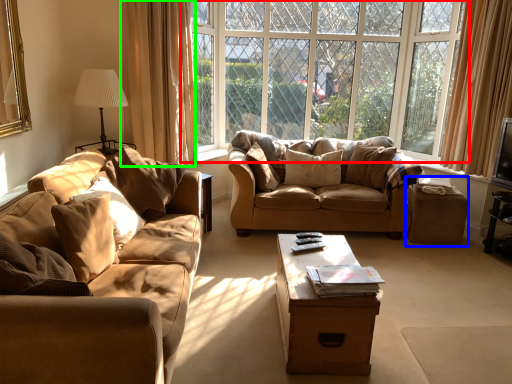
Question: Considering the real-world distances, which object is farthest from window (highlighted by a red box)? stool (highlighted by a blue box) or curtain (highlighted by a green box)?

Choices:
 (A) stool
 (B) curtain

Answer: (A)